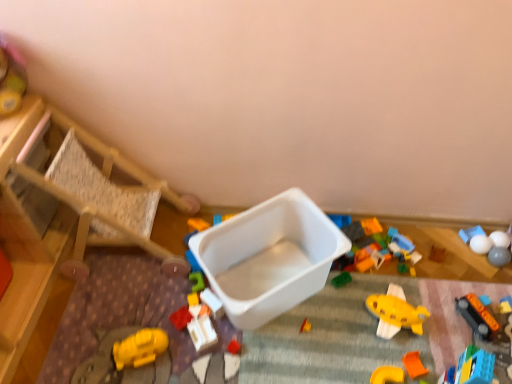
At what (x,y) coordinates should I click in order to perform the action: click on free space to the back side of smooth gray ball at lower right, the thirteenth toy when ordered from left to right. Please return your answer as a coordinate pair (x, y). Looking at the image, I should click on (474, 235).